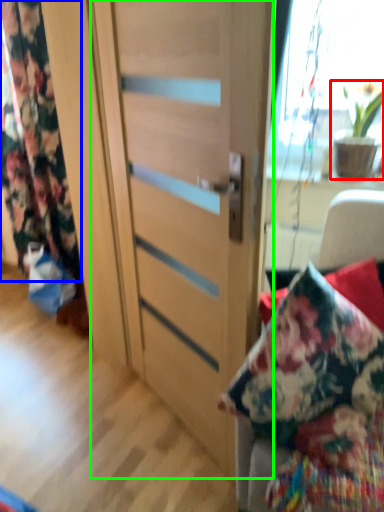
Question: Which object is positioned closest to houseplant (highlighted by a red box)? Select from curtain (highlighted by a blue box) and door (highlighted by a green box).

Choices:
 (A) curtain
 (B) door

Answer: (B)